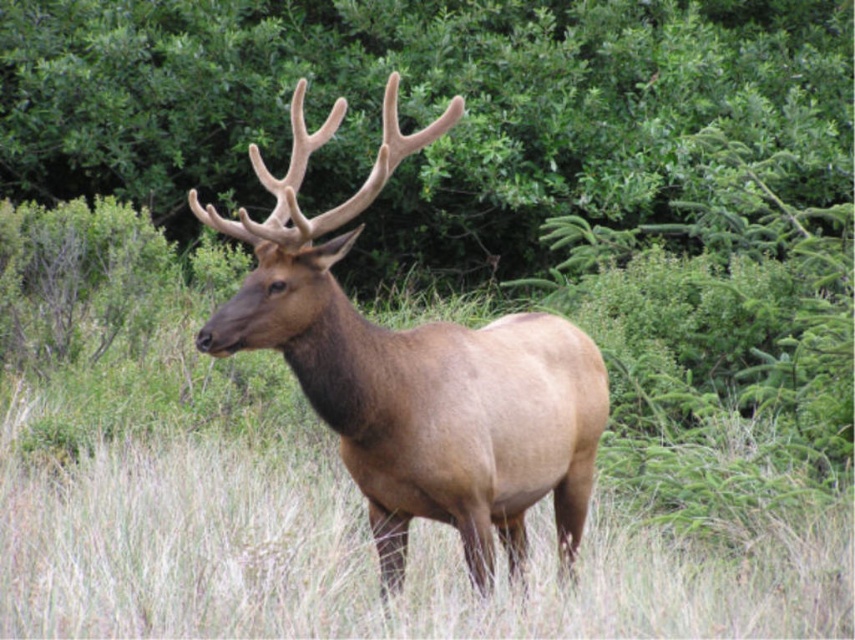
You are a hiker in the wilderness and see the green leafy tree at center and the brown velvet deer at center. Which one is taller?

The green leafy tree at center has a lesser height compared to brown velvet deer at center, so the brown velvet deer at center is taller.

What are the coordinates of the green leafy tree at center in the image?

The green leafy tree at center is located at coordinates (422, 108).